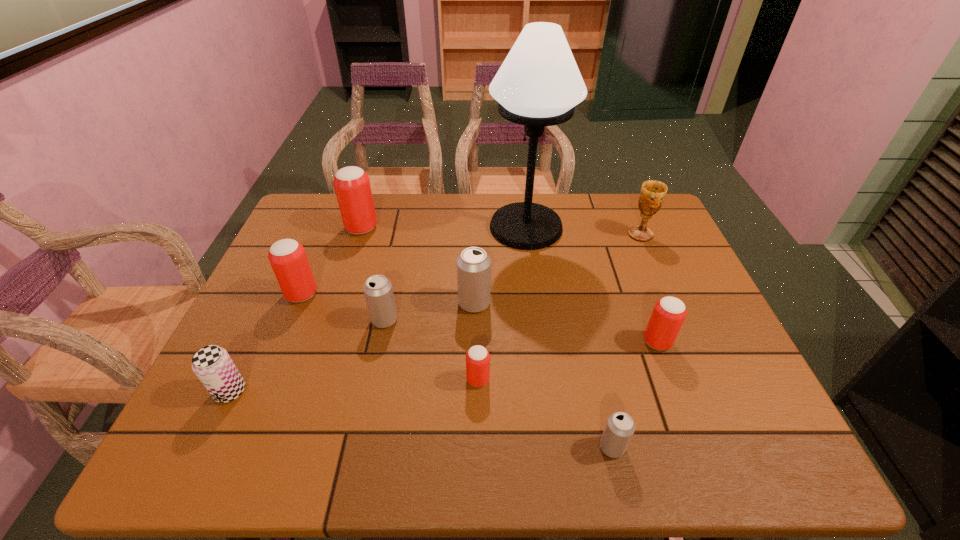
In order to click on vacant area that lies between the purple beer can and the smallest white beer can in this screenshot , I will do `click(421, 419)`.

The height and width of the screenshot is (540, 960). What are the coordinates of `empty space that is in between the nearest white beer can and the rightmost beer can` in the screenshot? It's located at (635, 394).

The height and width of the screenshot is (540, 960). Find the location of `free space between the second smallest white beer can and the tallest beer can`. free space between the second smallest white beer can and the tallest beer can is located at coordinates (373, 274).

The width and height of the screenshot is (960, 540). Find the location of `empty space between the tallest beer can and the second red beer can from right to left`. empty space between the tallest beer can and the second red beer can from right to left is located at coordinates (420, 303).

The image size is (960, 540). I want to click on vacant area that lies between the nearest beer can and the eighth object from right to left, so click(487, 338).

Identify the location of vacant space that is in between the biggest red beer can and the nearest object. (487, 338).

Identify the location of free space between the fourth nearest object and the leftmost red beer can. (479, 318).

At what (x,y) coordinates should I click in order to perform the action: click on vacant space that's between the third red beer can from left to right and the second smallest white beer can. Please return your answer as a coordinate pair (x, y). Image resolution: width=960 pixels, height=540 pixels. Looking at the image, I should click on (431, 349).

Locate an element on the screen. The width and height of the screenshot is (960, 540). the fifth closest object to the third nearest red beer can is located at coordinates (477, 357).

Select which object appears as the second closest to the second farthest red beer can. Please provide its 2D coordinates. Your answer should be formatted as a tuple, i.e. [(x, y)], where the tuple contains the x and y coordinates of a point satisfying the conditions above.

[(352, 186)]